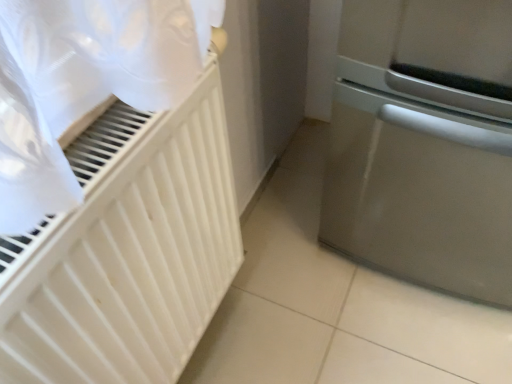
This screenshot has width=512, height=384. In order to click on satin silver dishwasher at right in this screenshot , I will do `click(424, 144)`.

Describe the element at coordinates (424, 144) in the screenshot. I see `satin silver dishwasher at right` at that location.

Where is `white matte radiator at left`? The image size is (512, 384). white matte radiator at left is located at coordinates (127, 251).

The height and width of the screenshot is (384, 512). Describe the element at coordinates (127, 251) in the screenshot. I see `white matte radiator at left` at that location.

This screenshot has height=384, width=512. I want to click on satin silver dishwasher at right, so click(424, 144).

Based on their positions, is white matte radiator at left located to the left or right of satin silver dishwasher at right?

From the image, it's evident that white matte radiator at left is to the left of satin silver dishwasher at right.

Is white matte radiator at left in front of satin silver dishwasher at right?

That is True.

Which is in front, point (29, 327) or point (362, 117)?

The point (29, 327) is in front.

From the picture: From the image's perspective, is white matte radiator at left located beneath satin silver dishwasher at right?

Correct, white matte radiator at left appears lower than satin silver dishwasher at right in the image.

From a real-world perspective, who is located lower, white matte radiator at left or satin silver dishwasher at right?

satin silver dishwasher at right, from a real-world perspective.

Can you confirm if white matte radiator at left is thinner than satin silver dishwasher at right?

Correct, the width of white matte radiator at left is less than that of satin silver dishwasher at right.

Between white matte radiator at left and satin silver dishwasher at right, which one has more height?

satin silver dishwasher at right.

Can you confirm if white matte radiator at left is bigger than satin silver dishwasher at right?

No, white matte radiator at left is not bigger than satin silver dishwasher at right.

Is satin silver dishwasher at right a part of white matte radiator at left?

No.

Is white matte radiator at left placed right next to satin silver dishwasher at right?

white matte radiator at left and satin silver dishwasher at right are clearly separated.

Is white matte radiator at left looking in the opposite direction of satin silver dishwasher at right?

white matte radiator at left does not have its back to satin silver dishwasher at right.

How many degrees apart are the facing directions of white matte radiator at left and satin silver dishwasher at right?

white matte radiator at left and satin silver dishwasher at right are facing 90 degrees away from each other.

Measure the distance from white matte radiator at left to satin silver dishwasher at right.

white matte radiator at left and satin silver dishwasher at right are 44.20 centimeters apart.

Locate an element on the screen. The height and width of the screenshot is (384, 512). home appliance that appears behind the white matte radiator at left is located at coordinates (424, 144).

Considering the positions of objects satin silver dishwasher at right and white matte radiator at left in the image provided, who is more to the right, satin silver dishwasher at right or white matte radiator at left?

satin silver dishwasher at right is more to the right.

Considering their positions, is satin silver dishwasher at right located in front of or behind white matte radiator at left?

satin silver dishwasher at right is positioned farther from the viewer than white matte radiator at left.

Does point (467, 50) appear closer or farther from the camera than point (111, 372)?

Point (467, 50) is farther from the camera than point (111, 372).

From the image's perspective, which is above, satin silver dishwasher at right or white matte radiator at left?

From the image's view, satin silver dishwasher at right is above.

From a real-world perspective, is satin silver dishwasher at right located higher than white matte radiator at left?

No, from a real-world perspective, satin silver dishwasher at right is not above white matte radiator at left.

Based on the photo, does satin silver dishwasher at right have a greater width compared to white matte radiator at left?

Correct, the width of satin silver dishwasher at right exceeds that of white matte radiator at left.

Considering the sizes of objects satin silver dishwasher at right and white matte radiator at left in the image provided, who is shorter, satin silver dishwasher at right or white matte radiator at left?

With less height is white matte radiator at left.

Can you confirm if satin silver dishwasher at right is bigger than white matte radiator at left?

Yes.

Can we say satin silver dishwasher at right lies outside white matte radiator at left?

satin silver dishwasher at right lies outside white matte radiator at left's area.

Is satin silver dishwasher at right not near white matte radiator at left?

No, there isn't a large distance between satin silver dishwasher at right and white matte radiator at left.

Is satin silver dishwasher at right positioned with its back to white matte radiator at left?

satin silver dishwasher at right is not turned away from white matte radiator at left.

This screenshot has height=384, width=512. I want to click on radiator on the left of satin silver dishwasher at right, so click(x=127, y=251).

Where is `home appliance behind the white matte radiator at left`? home appliance behind the white matte radiator at left is located at coordinates (424, 144).

Identify the location of home appliance on the right of the white matte radiator at left. Image resolution: width=512 pixels, height=384 pixels. (424, 144).